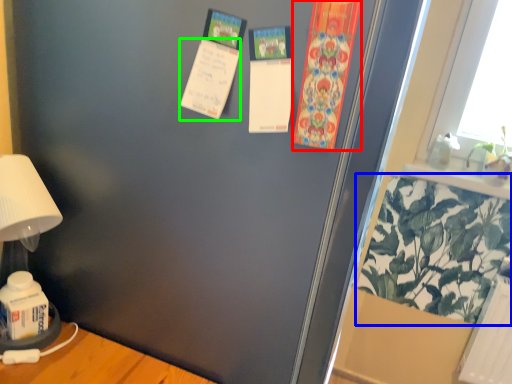
Question: Which is nearer to the postcard (highlighted by a red box)? plant (highlighted by a blue box) or postcard (highlighted by a green box).

Choices:
 (A) plant
 (B) postcard

Answer: (B)